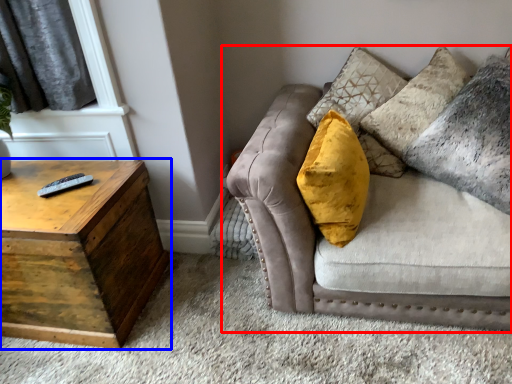
Question: Which object appears closest to the camera in this image, studio couch (highlighted by a red box) or table (highlighted by a blue box)?

Choices:
 (A) studio couch
 (B) table

Answer: (A)